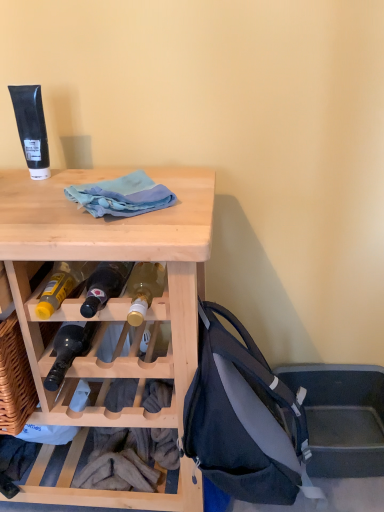
This screenshot has width=384, height=512. I want to click on free location in front of light blue fabric at center, so click(115, 231).